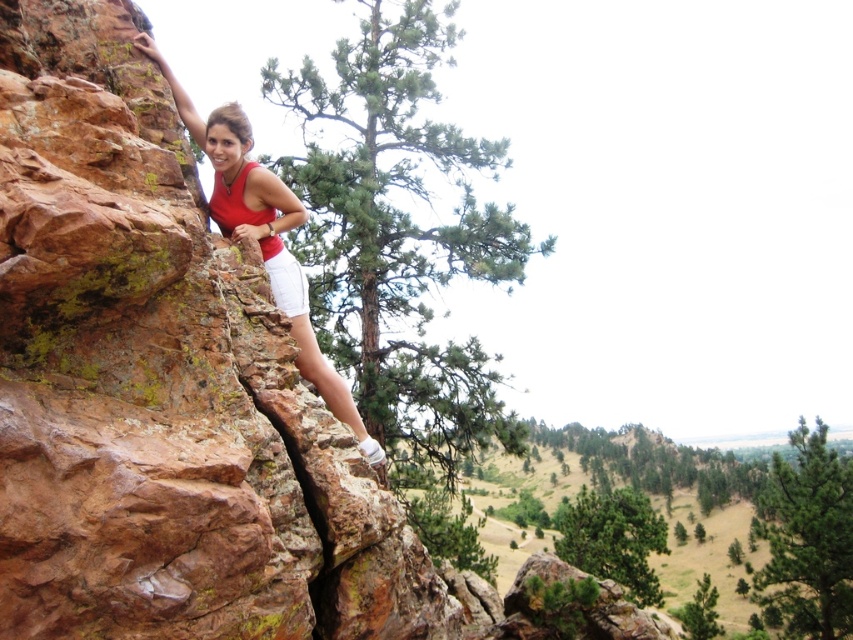
Question: Which point is closer to the camera?

Choices:
 (A) (238, 156)
 (B) (300, 307)
 (C) (820, 628)

Answer: (A)

Question: Does matte red tank top at center have a smaller size compared to white cotton shorts at center?

Choices:
 (A) yes
 (B) no

Answer: (B)

Question: Does green matte pine at upper center lie behind white cotton shorts at center?

Choices:
 (A) yes
 (B) no

Answer: (A)

Question: Which object is farther from the camera taking this photo?

Choices:
 (A) white cotton shorts at center
 (B) green matte pine at upper center

Answer: (B)

Question: Can you confirm if green matte pine at upper center is positioned below matte red tank top at center?

Choices:
 (A) no
 (B) yes

Answer: (B)

Question: Which point is closer to the camera?

Choices:
 (A) (283, 305)
 (B) (817, 529)

Answer: (A)